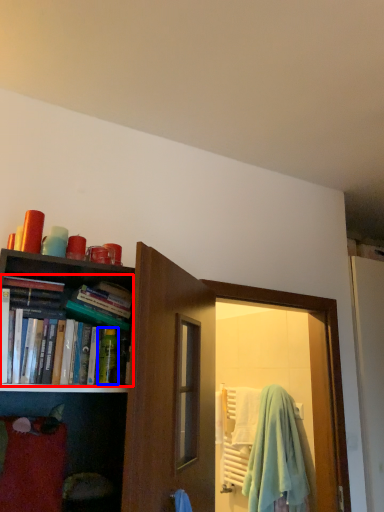
Question: Which object is closer to the camera taking this photo, book (highlighted by a red box) or toiletry (highlighted by a blue box)?

Choices:
 (A) book
 (B) toiletry

Answer: (A)